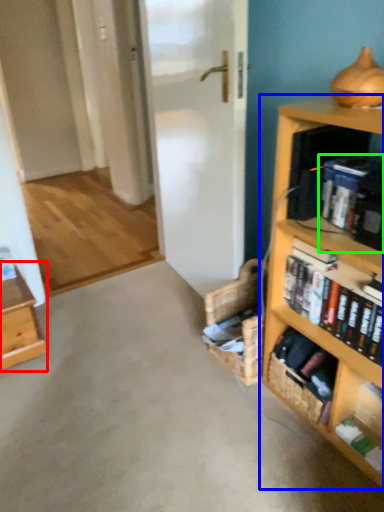
Question: Which is nearer to the table (highlighted by a red box)? bookcase (highlighted by a blue box) or book (highlighted by a green box).

Choices:
 (A) bookcase
 (B) book

Answer: (A)